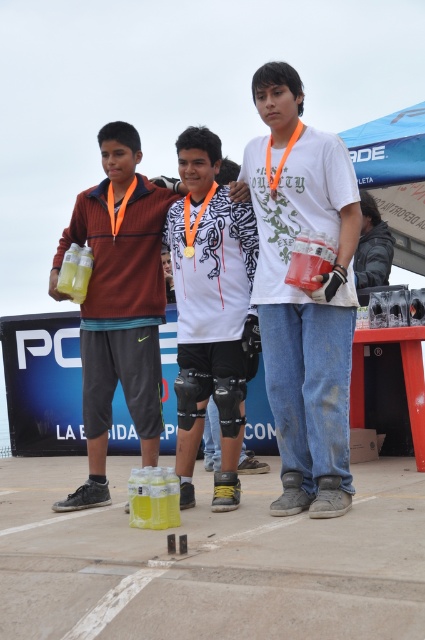
Between white matte t-shirt at center and matte black glove at center, which one appears on the right side from the viewer's perspective?

From the viewer's perspective, matte black glove at center appears more on the right side.

Does white matte t-shirt at center appear on the left side of matte black glove at center?

Correct, you'll find white matte t-shirt at center to the left of matte black glove at center.

Is point (283, 156) less distant than point (365, 269)?

Yes, it is.

Find the location of a particular element. white matte t-shirt at center is located at coordinates tap(303, 292).

Does matte plastic bottles at center appear on the left side of matte black glove at center?

Indeed, matte plastic bottles at center is positioned on the left side of matte black glove at center.

Between matte plastic bottles at center and matte black glove at center, which one appears on the right side from the viewer's perspective?

matte black glove at center

Image resolution: width=425 pixels, height=640 pixels. Find the location of `matte plastic bottles at center`. matte plastic bottles at center is located at coordinates (119, 301).

Is matte plastic bottles at center taller than white matte shirt at center?

Yes.

Between point (138, 176) and point (192, 289), which one is positioned behind?

The point (138, 176) is more distant.

What are the coordinates of `matte plastic bottles at center` in the screenshot? It's located at (119, 301).